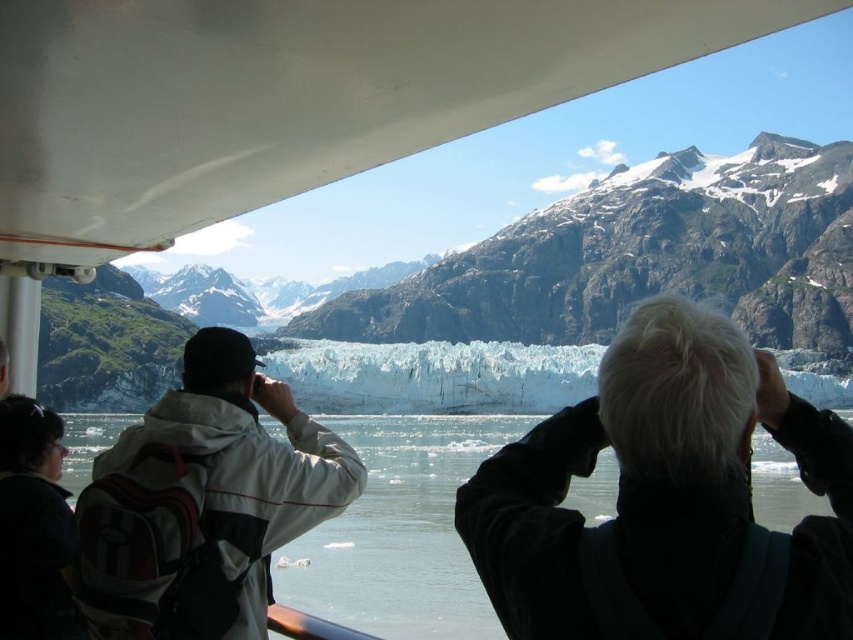
Which is below, white matte jacket at center or dark gray backpack at lower left?

dark gray backpack at lower left

Is white matte jacket at center bigger than dark gray backpack at lower left?

Yes, white matte jacket at center is bigger than dark gray backpack at lower left.

Is point (241, 557) less distant than point (19, 586)?

No, it is behind (19, 586).

I want to click on white matte jacket at center, so click(x=204, y=502).

Image resolution: width=853 pixels, height=640 pixels. What are the coordinates of `white matte hair at upper right` in the screenshot? It's located at (666, 499).

Which of these two, white matte hair at upper right or clear water at center, stands shorter?

→ clear water at center

Where is `white matte hair at upper right`? white matte hair at upper right is located at coordinates (666, 499).

Locate an element on the screen. The image size is (853, 640). white matte hair at upper right is located at coordinates (666, 499).

Can you confirm if white matte hair at upper right is positioned to the right of dark gray backpack at lower left?

Correct, you'll find white matte hair at upper right to the right of dark gray backpack at lower left.

At what (x,y) coordinates should I click in order to perform the action: click on white matte hair at upper right. Please return your answer as a coordinate pair (x, y). The width and height of the screenshot is (853, 640). Looking at the image, I should click on (666, 499).

Where is `white matte hair at upper right`? white matte hair at upper right is located at coordinates (666, 499).